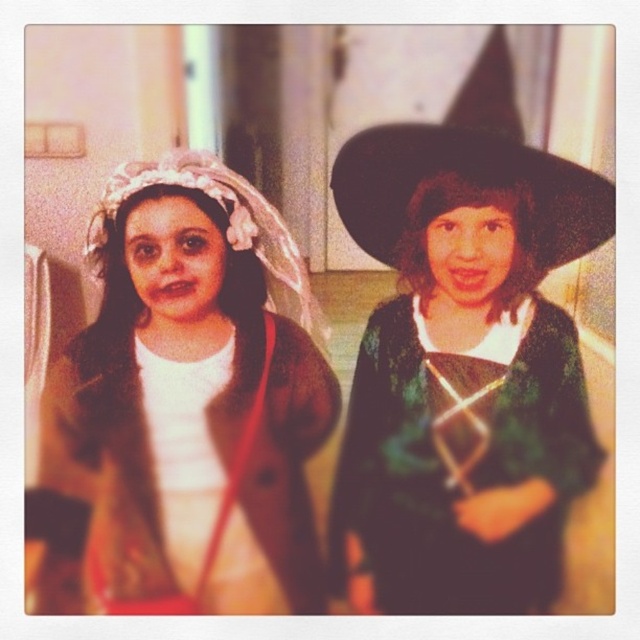
You are a photographer setting up for a group photo of the two children. You need to ensure the green velvet dress at right is visible in the frame. Where should you position the camera relative to the point marked at coordinates [465,472]?

The point at coordinates [465,472] marks the green velvet dress at right. To ensure it is visible in the frame, position the camera so that the point is within the camera view. Since the dress is at the right, the camera should be positioned to the left of the point to capture it fully in the frame.

You are a costume designer observing the image. You need to determine the spatial relationship between the matte brown coat at center and the black felt witch hat at upper right. Which object is positioned higher in the image?

The black felt witch hat at upper right is positioned higher in the image than the matte brown coat at center, as the matte brown coat at center is located below it.